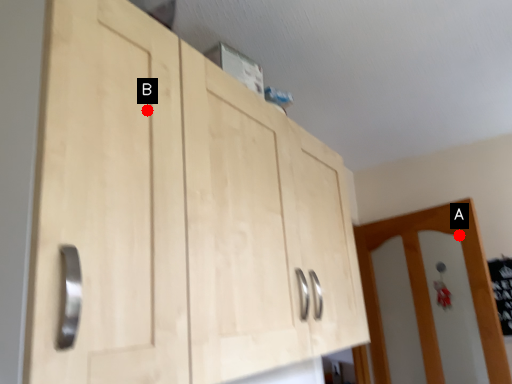
Question: Two points are circled on the image, labeled by A and B beside each circle. Which point is farther from the camera taking this photo?

Choices:
 (A) A is further
 (B) B is further

Answer: (A)